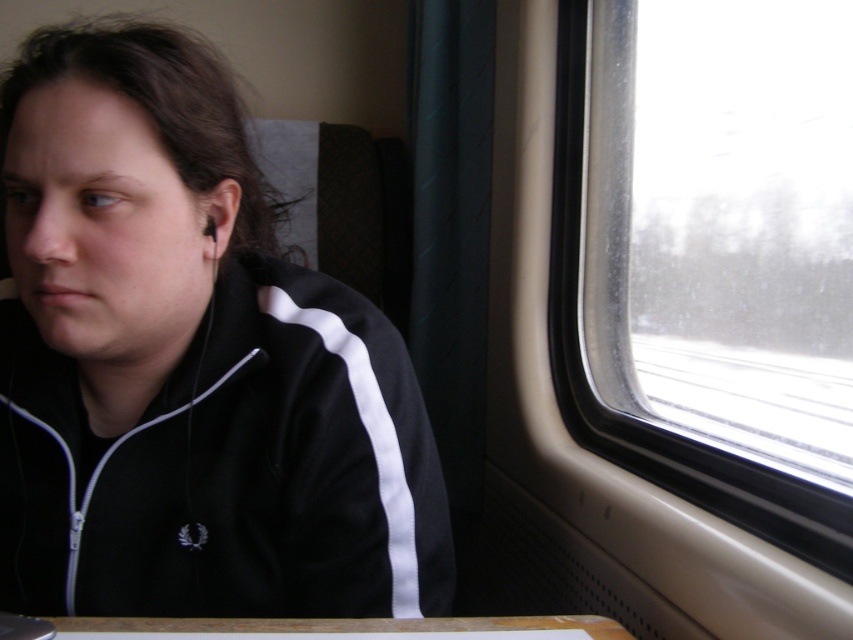
Can you confirm if transparent glass window at right is positioned above wooden table at lower center?

Indeed, transparent glass window at right is positioned over wooden table at lower center.

Between transparent glass window at right and wooden table at lower center, which one is positioned higher?

Positioned higher is transparent glass window at right.

The width and height of the screenshot is (853, 640). I want to click on transparent glass window at right, so click(724, 224).

Consider the image. Is black matte jacket at left below wooden table at lower center?

No.

Is point (68, 173) in front of point (44, 628)?

No, it is not.

What are the coordinates of `black matte jacket at left` in the screenshot? It's located at (189, 364).

Does black matte jacket at left appear on the right side of transparent glass window at right?

Incorrect, black matte jacket at left is not on the right side of transparent glass window at right.

Does black matte jacket at left have a smaller size compared to transparent glass window at right?

No, black matte jacket at left is not smaller than transparent glass window at right.

Does point (10, 120) lie behind point (608, 216)?

No, it is in front of (608, 216).

Find the location of a particular element. black matte jacket at left is located at coordinates (189, 364).